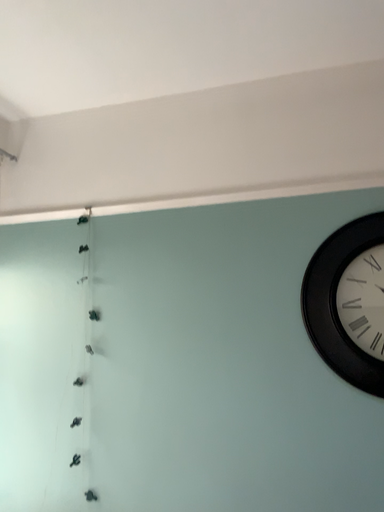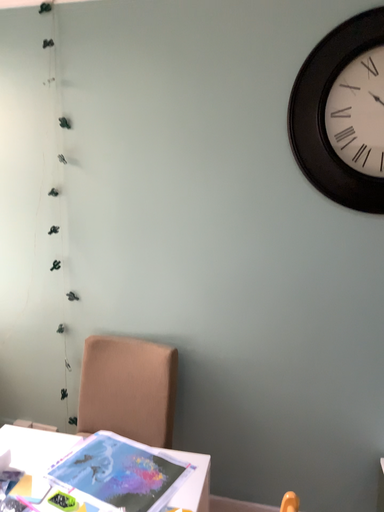
Question: How did the camera likely rotate when shooting the video?

Choices:
 (A) rotated upward
 (B) rotated downward

Answer: (B)